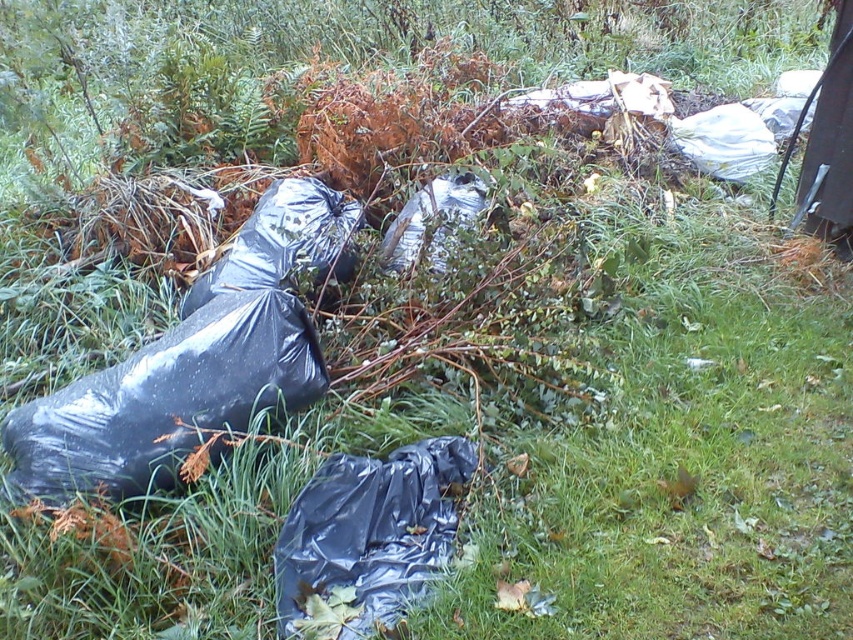
Question: Which point is farther from the camera taking this photo?

Choices:
 (A) 393,477
 (B) 239,342

Answer: (B)

Question: Can you confirm if black plastic bag at left is positioned to the right of black plastic bag at lower center?

Choices:
 (A) yes
 (B) no

Answer: (B)

Question: Does black plastic bag at left have a larger size compared to black plastic bag at lower center?

Choices:
 (A) no
 (B) yes

Answer: (B)

Question: Can you confirm if black plastic bag at left is smaller than black plastic bag at lower center?

Choices:
 (A) no
 (B) yes

Answer: (A)